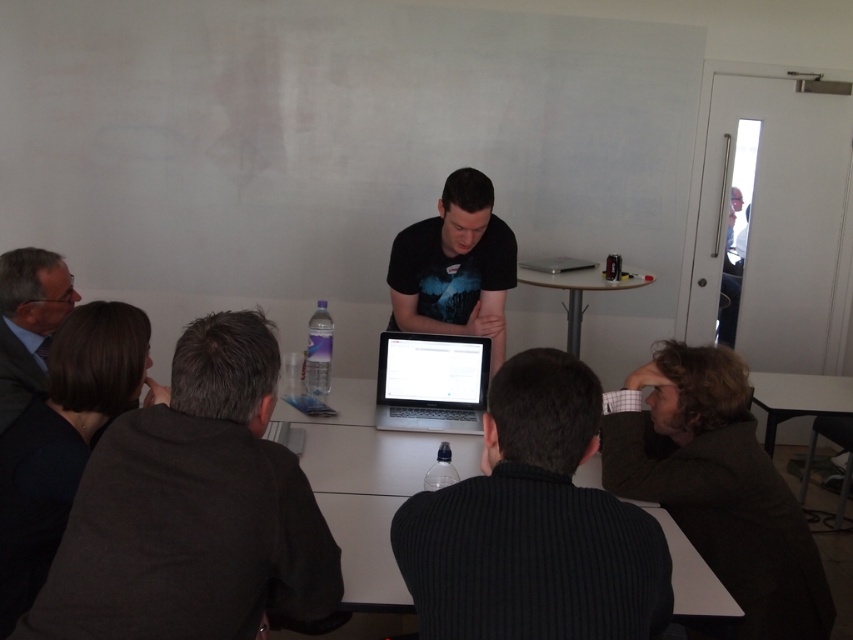
Question: Is dark brown sweater at lower right behind black matte t-shirt at center?

Choices:
 (A) yes
 (B) no

Answer: (B)

Question: Among these objects, which one is nearest to the camera?

Choices:
 (A) dark brown sweater at lower right
 (B) black matte t-shirt at center
 (C) silver metallic laptop at center
 (D) dark gray ribbed sweater at center

Answer: (D)

Question: Where is dark gray sweater at lower left located in relation to dark gray suit at left in the image?

Choices:
 (A) right
 (B) left

Answer: (A)

Question: Does dark gray ribbed sweater at center appear on the right side of silver metallic laptop at center?

Choices:
 (A) yes
 (B) no

Answer: (B)

Question: Which is nearer to the black matte t-shirt at center?

Choices:
 (A) white glossy table at center
 (B) dark gray suit at left

Answer: (A)

Question: Which object is farther from the camera taking this photo?

Choices:
 (A) white glossy table at lower right
 (B) dark gray sweater at lower left
 (C) dark gray suit at left
 (D) black matte t-shirt at center

Answer: (A)